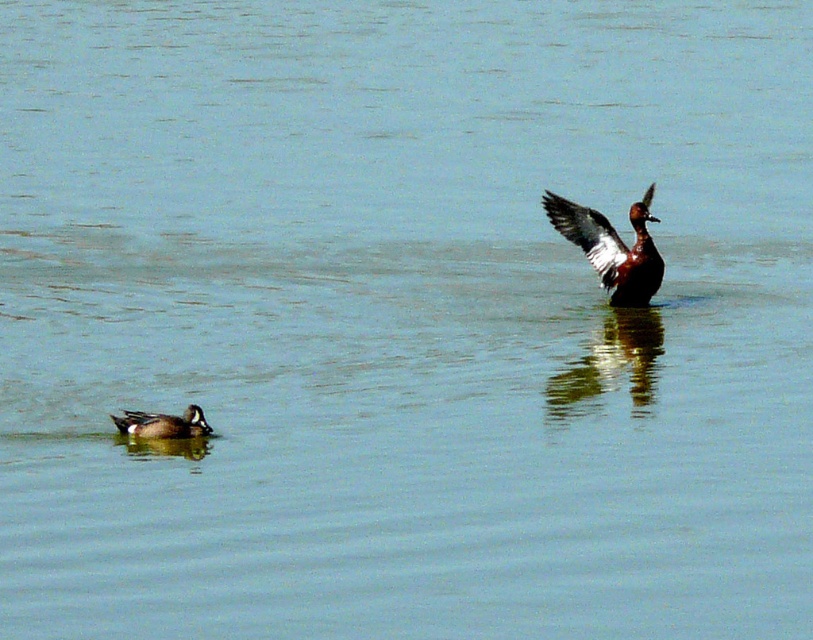
You are standing at the edge of the water and want to throw a small pebble to hit the brown glossy duck at upper right. The coordinates of the point you need to aim for are given as point (612, 248). Is this point located on the brown glossy duck at upper right?

Yes, the point (612, 248) is located on the brown glossy duck at upper right according to the provided coordinates.